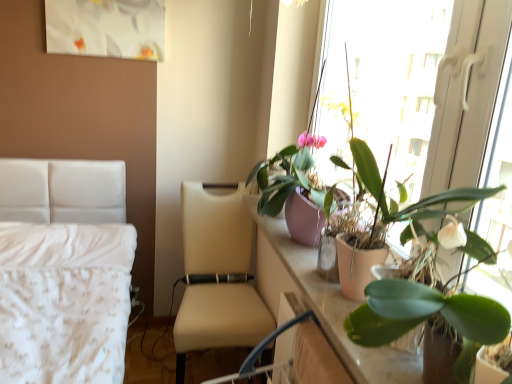
Where is `green matte plant at upper right, placed as the first houseplant when sorted from bottom to top`? green matte plant at upper right, placed as the first houseplant when sorted from bottom to top is located at coordinates (423, 313).

What is the approximate width of green matte plant at right, acting as the 3th houseplant starting from the bottom?

6.37 inches.

Locate an element on the screen. This screenshot has width=512, height=384. pink matte pot at upper right, which appears as the 2th houseplant when viewed from the top is located at coordinates (295, 189).

The image size is (512, 384). Identify the location of pink matte plant pot at right. coord(381,83).

From the image's perspective, between pink matte pot at upper right, which is the second houseplant in bottom-to-top order, and green matte plant at upper right, placed as the first houseplant when sorted from bottom to top, who is located below?

From the image's view, green matte plant at upper right, placed as the first houseplant when sorted from bottom to top, is below.

Looking at this image, based on their positions, is pink matte pot at upper right, which is the second houseplant in bottom-to-top order, located to the left or right of green matte plant at upper right, placed as the first houseplant when sorted from bottom to top?

From the image, it's evident that pink matte pot at upper right, which is the second houseplant in bottom-to-top order, is to the left of green matte plant at upper right, placed as the first houseplant when sorted from bottom to top.

Is pink matte pot at upper right, which is the second houseplant in bottom-to-top order, oriented away from green matte plant at upper right, placed as the first houseplant when sorted from bottom to top?

pink matte pot at upper right, which is the second houseplant in bottom-to-top order, is not turned away from green matte plant at upper right, placed as the first houseplant when sorted from bottom to top.

Considering the sizes of objects pink matte pot at upper right, which appears as the 2th houseplant when viewed from the top, and green matte plant at upper right, placed as the first houseplant when sorted from bottom to top, in the image provided, who is wider, pink matte pot at upper right, which appears as the 2th houseplant when viewed from the top, or green matte plant at upper right, placed as the first houseplant when sorted from bottom to top,?

pink matte pot at upper right, which appears as the 2th houseplant when viewed from the top, is wider.

Is beige leather chair at center inside green matte plant at upper right, which is the third houseplant from top to bottom?

No.

Is beige leather chair at center at the back of green matte plant at upper right, placed as the first houseplant when sorted from bottom to top?

That's not correct — green matte plant at upper right, placed as the first houseplant when sorted from bottom to top, is not looking away from beige leather chair at center.

Can you confirm if green matte plant at upper right, placed as the first houseplant when sorted from bottom to top, is taller than beige leather chair at center?

In fact, green matte plant at upper right, placed as the first houseplant when sorted from bottom to top, may be shorter than beige leather chair at center.

Is green matte plant at upper right, which is the third houseplant from top to bottom, at the left side of beige leather chair at center?

Incorrect, green matte plant at upper right, which is the third houseplant from top to bottom, is not on the left side of beige leather chair at center.

Which is nearer, (428, 304) or (352, 28)?

The point (428, 304) is closer to the camera.

In terms of width, does green matte plant at right, acting as the 3th houseplant starting from the bottom, look wider or thinner when compared to pink matte plant pot at right?

Clearly, green matte plant at right, acting as the 3th houseplant starting from the bottom, has less width compared to pink matte plant pot at right.

Who is taller, green matte plant at right, which ranks as the first houseplant in top-to-bottom order, or pink matte plant pot at right?

Standing taller between the two is green matte plant at right, which ranks as the first houseplant in top-to-bottom order.

Could pink matte plant pot at right be considered to be inside green matte plant at right, acting as the 3th houseplant starting from the bottom?

No, pink matte plant pot at right is located outside of green matte plant at right, acting as the 3th houseplant starting from the bottom.

Is pink matte pot at upper right, which appears as the 2th houseplant when viewed from the top, to the left or to the right of pink matte plant pot at right in the image?

In the image, pink matte pot at upper right, which appears as the 2th houseplant when viewed from the top, appears on the left side of pink matte plant pot at right.

Would you say pink matte pot at upper right, which appears as the 2th houseplant when viewed from the top, is inside or outside pink matte plant pot at right?

pink matte pot at upper right, which appears as the 2th houseplant when viewed from the top, is located inside pink matte plant pot at right.

Is pink matte pot at upper right, which is the second houseplant in bottom-to-top order, in front of or behind pink matte plant pot at right in the image?

pink matte pot at upper right, which is the second houseplant in bottom-to-top order, is positioned farther from the viewer than pink matte plant pot at right.

From the image's perspective, which is below, beige leather chair at center or pink matte plant pot at right?

beige leather chair at center.

Which of these two, beige leather chair at center or pink matte plant pot at right, is thinner?

Thinner between the two is pink matte plant pot at right.

At what (x,y) coordinates should I click in order to perform the action: click on chair on the left side of pink matte plant pot at right. Please return your answer as a coordinate pair (x, y). The width and height of the screenshot is (512, 384). Looking at the image, I should click on (219, 319).

Is pink matte plant pot at right inside the boundaries of green matte plant at right, which ranks as the first houseplant in top-to-bottom order, or outside?

pink matte plant pot at right cannot be found inside green matte plant at right, which ranks as the first houseplant in top-to-bottom order.

Where is `the 2nd houseplant in front of the pink matte plant pot at right, starting your count from the anchor`? The height and width of the screenshot is (384, 512). the 2nd houseplant in front of the pink matte plant pot at right, starting your count from the anchor is located at coordinates (422, 313).

From a real-world perspective, is pink matte plant pot at right on top of green matte plant at right, which ranks as the first houseplant in top-to-bottom order?

No, from a real-world perspective, pink matte plant pot at right is not over green matte plant at right, which ranks as the first houseplant in top-to-bottom order

Is pink matte plant pot at right at the left side of green matte plant at right, which ranks as the first houseplant in top-to-bottom order?

Indeed, pink matte plant pot at right is positioned on the left side of green matte plant at right, which ranks as the first houseplant in top-to-bottom order.

From a real-world perspective, is beige leather chair at center physically located above or below pink matte pot at upper right, which is the second houseplant in bottom-to-top order?

beige leather chair at center is situated lower than pink matte pot at upper right, which is the second houseplant in bottom-to-top order, in the real world.

Who is more distant, beige leather chair at center or pink matte pot at upper right, which appears as the 2th houseplant when viewed from the top?

beige leather chair at center is further from the camera.

Locate an element on the screen. chair on the left of pink matte pot at upper right, which is the second houseplant in bottom-to-top order is located at coordinates (219, 319).

Can you see beige leather chair at center touching pink matte pot at upper right, which appears as the 2th houseplant when viewed from the top?

No, beige leather chair at center is not beside pink matte pot at upper right, which appears as the 2th houseplant when viewed from the top.

This screenshot has width=512, height=384. In order to click on houseplant below the pink matte pot at upper right, which appears as the 2th houseplant when viewed from the top (from the image's perspective) in this screenshot , I will do `click(423, 313)`.

This screenshot has height=384, width=512. Find the location of `the 2nd houseplant counting from the right of the beige leather chair at center`. the 2nd houseplant counting from the right of the beige leather chair at center is located at coordinates (423, 313).

From the image, which object appears to be farther from green matte plant at right, which ranks as the first houseplant in top-to-bottom order, pink matte plant pot at right or beige leather chair at center?

beige leather chair at center is further to green matte plant at right, which ranks as the first houseplant in top-to-bottom order.

From the image, which object appears to be farther from green matte plant at upper right, which is the third houseplant from top to bottom, pink matte plant pot at right or pink matte pot at upper right, which is the second houseplant in bottom-to-top order?

Among the two, pink matte plant pot at right is located further to green matte plant at upper right, which is the third houseplant from top to bottom.

Considering their positions, is pink matte pot at upper right, which is the second houseplant in bottom-to-top order, positioned closer to pink matte plant pot at right than green matte plant at right, which ranks as the first houseplant in top-to-bottom order?

pink matte pot at upper right, which is the second houseplant in bottom-to-top order.

Estimate the real-world distances between objects in this image. Which object is closer to pink matte pot at upper right, which appears as the 2th houseplant when viewed from the top, green matte plant at right, which ranks as the first houseplant in top-to-bottom order, or beige leather chair at center?

The object closer to pink matte pot at upper right, which appears as the 2th houseplant when viewed from the top, is green matte plant at right, which ranks as the first houseplant in top-to-bottom order.

Based on their spatial positions, is green matte plant at upper right, placed as the first houseplant when sorted from bottom to top, or green matte plant at right, acting as the 3th houseplant starting from the bottom, closer to beige leather chair at center?

green matte plant at right, acting as the 3th houseplant starting from the bottom, is closer to beige leather chair at center.

Consider the image. Considering their positions, is green matte plant at right, which ranks as the first houseplant in top-to-bottom order, positioned closer to pink matte plant pot at right than pink matte pot at upper right, which appears as the 2th houseplant when viewed from the top?

Among the two, pink matte pot at upper right, which appears as the 2th houseplant when viewed from the top, is located nearer to pink matte plant pot at right.

Estimate the real-world distances between objects in this image. Which object is closer to pink matte plant pot at right, green matte plant at upper right, placed as the first houseplant when sorted from bottom to top, or green matte plant at right, which ranks as the first houseplant in top-to-bottom order?

The object closer to pink matte plant pot at right is green matte plant at right, which ranks as the first houseplant in top-to-bottom order.

Estimate the real-world distances between objects in this image. Which object is closer to green matte plant at right, which ranks as the first houseplant in top-to-bottom order, beige leather chair at center or pink matte pot at upper right, which is the second houseplant in bottom-to-top order?

Among the two, pink matte pot at upper right, which is the second houseplant in bottom-to-top order, is located nearer to green matte plant at right, which ranks as the first houseplant in top-to-bottom order.

Locate an element on the screen. The width and height of the screenshot is (512, 384). window screen positioned between green matte plant at right, acting as the 3th houseplant starting from the bottom, and pink matte pot at upper right, which is the second houseplant in bottom-to-top order, from near to far is located at coordinates (381, 83).

Where is `window screen located between green matte plant at right, acting as the 3th houseplant starting from the bottom, and beige leather chair at center in the depth direction`? Image resolution: width=512 pixels, height=384 pixels. window screen located between green matte plant at right, acting as the 3th houseplant starting from the bottom, and beige leather chair at center in the depth direction is located at coordinates (381, 83).

Identify the location of window screen between green matte plant at upper right, which is the third houseplant from top to bottom, and beige leather chair at center in the front-back direction. This screenshot has height=384, width=512. (381, 83).

You are a GUI agent. You are given a task and a screenshot of the screen. Output one action in this format:
    pyautogui.click(x=<x>, y=<y>)
    Task: Click on the window screen between green matte plant at upper right, placed as the first houseplant when sorted from bottom to top, and pink matte pot at upper right, which appears as the 2th houseplant when viewed from the top, from front to back
    The height and width of the screenshot is (384, 512).
    Given the screenshot: What is the action you would take?
    coord(381,83)